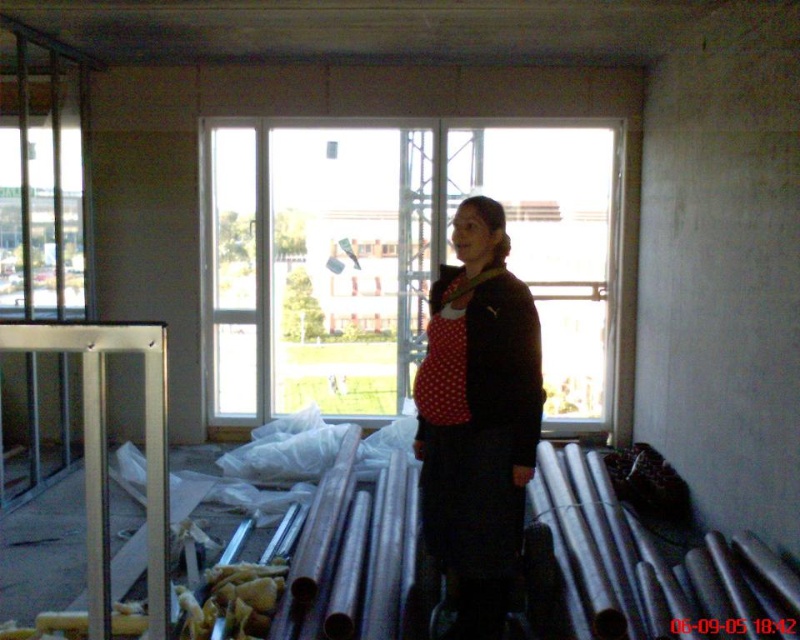
Question: Does transparent glass window at center have a lesser width compared to polka dot fabric dress at center?

Choices:
 (A) no
 (B) yes

Answer: (A)

Question: Is transparent glass window at center positioned before polka dot fabric dress at center?

Choices:
 (A) no
 (B) yes

Answer: (A)

Question: Among these points, which one is nearest to the camera?

Choices:
 (A) (584, 273)
 (B) (513, 554)

Answer: (B)

Question: Which point is closer to the camera?

Choices:
 (A) polka dot fabric dress at center
 (B) transparent glass window at center

Answer: (A)

Question: Is transparent glass window at center in front of polka dot fabric dress at center?

Choices:
 (A) yes
 (B) no

Answer: (B)